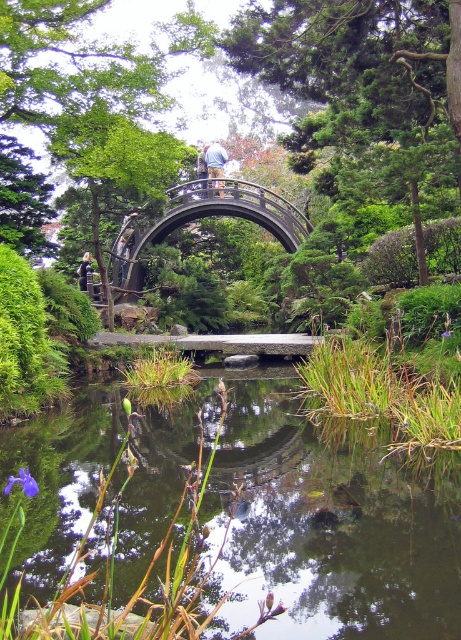
Which is behind, point (277, 595) or point (123, 280)?

The point (123, 280) is behind.

Who is more forward, [152,480] or [164,234]?

Point [152,480] is more forward.

This screenshot has height=640, width=461. Find the location of `green grassy water at center`. green grassy water at center is located at coordinates (327, 525).